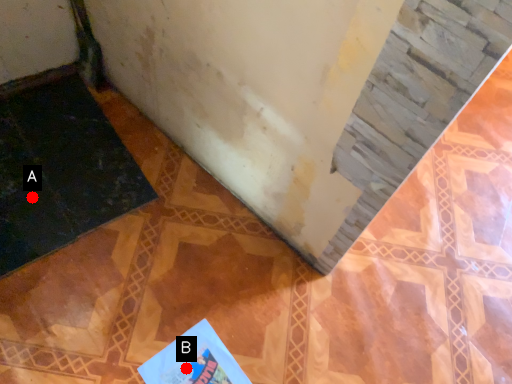
Question: Two points are circled on the image, labeled by A and B beside each circle. Which of the following is the farthest from the observer?

Choices:
 (A) A is further
 (B) B is further

Answer: (A)